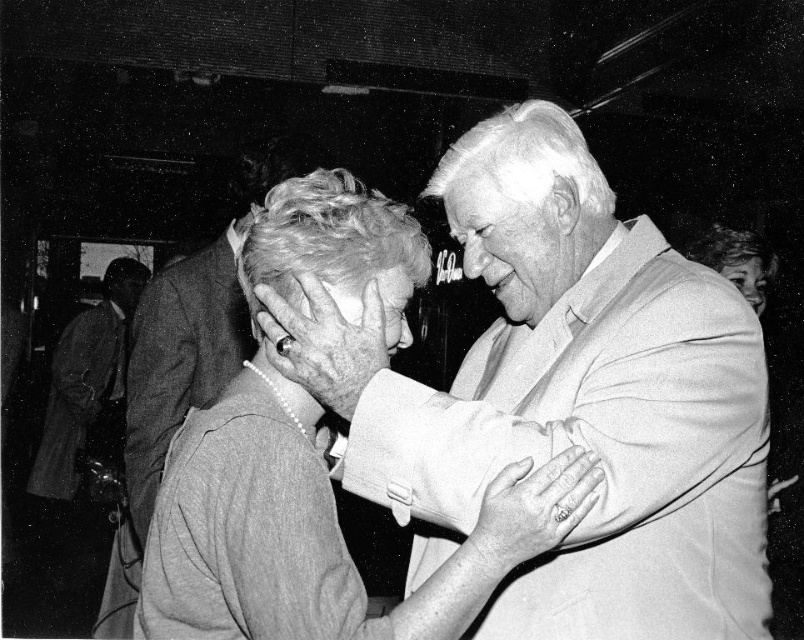
Question: Does smooth skin face at center appear on the left side of smooth gray hair at center?

Choices:
 (A) yes
 (B) no

Answer: (B)

Question: Which of the following is the closest to the observer?

Choices:
 (A) (275, 141)
 (B) (281, 269)

Answer: (B)

Question: Which is farther from the smooth gray hair at center?

Choices:
 (A) smooth beige suit at upper right
 (B) smooth gray sweater at center

Answer: (B)

Question: Estimate the real-world distances between objects in this image. Which object is farther from the curly blonde hair at center?

Choices:
 (A) smooth gray hair at center
 (B) smooth skin face at center

Answer: (A)

Question: Can you confirm if gray hair at center is positioned below smooth gray hair at center?

Choices:
 (A) no
 (B) yes

Answer: (A)

Question: Does gray hair at center have a lesser width compared to smooth gray hair at center?

Choices:
 (A) yes
 (B) no

Answer: (A)